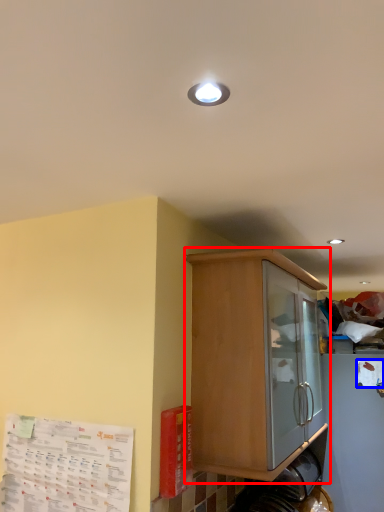
Question: Which of the following is the farthest to the observer, cabinetry (highlighted by a red box) or paper (highlighted by a blue box)?

Choices:
 (A) cabinetry
 (B) paper

Answer: (B)